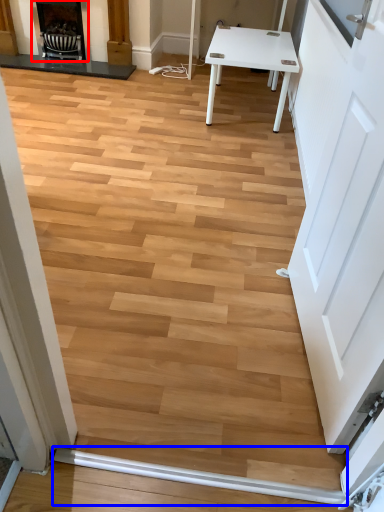
Question: Which object is further to the camera taking this photo, fireplace (highlighted by a red box) or beam (highlighted by a blue box)?

Choices:
 (A) fireplace
 (B) beam

Answer: (A)